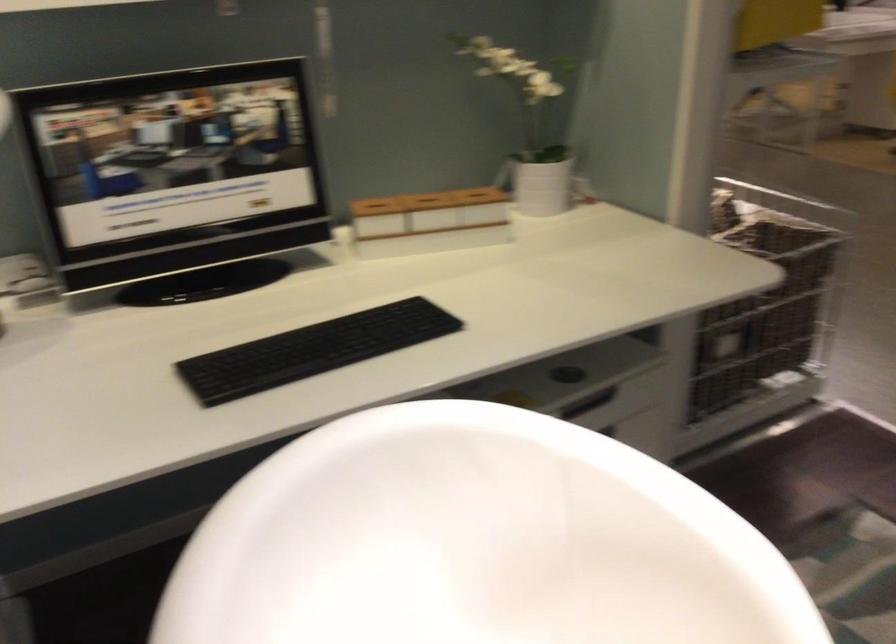
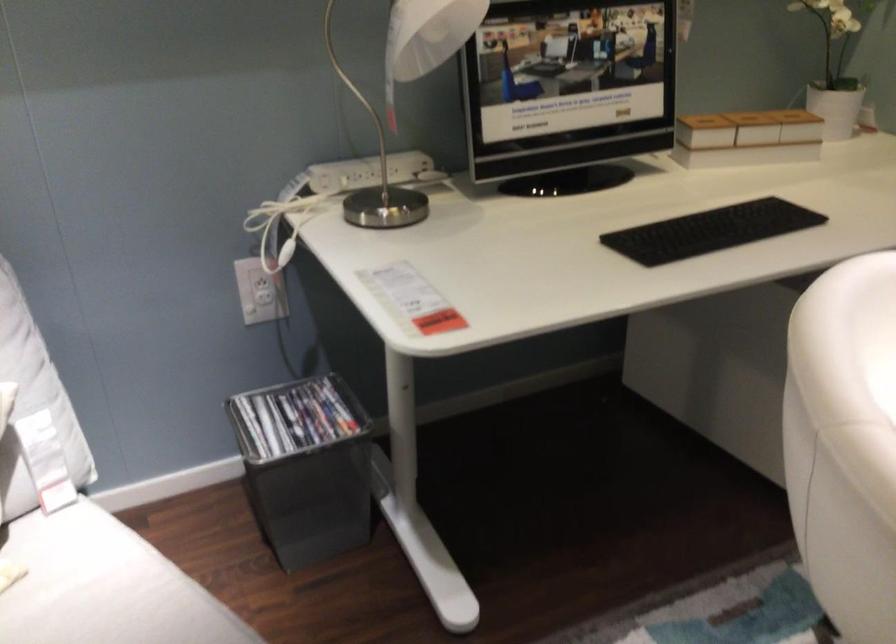
In the second image, find the point that corresponds to point (474, 193) in the first image.

(799, 109)